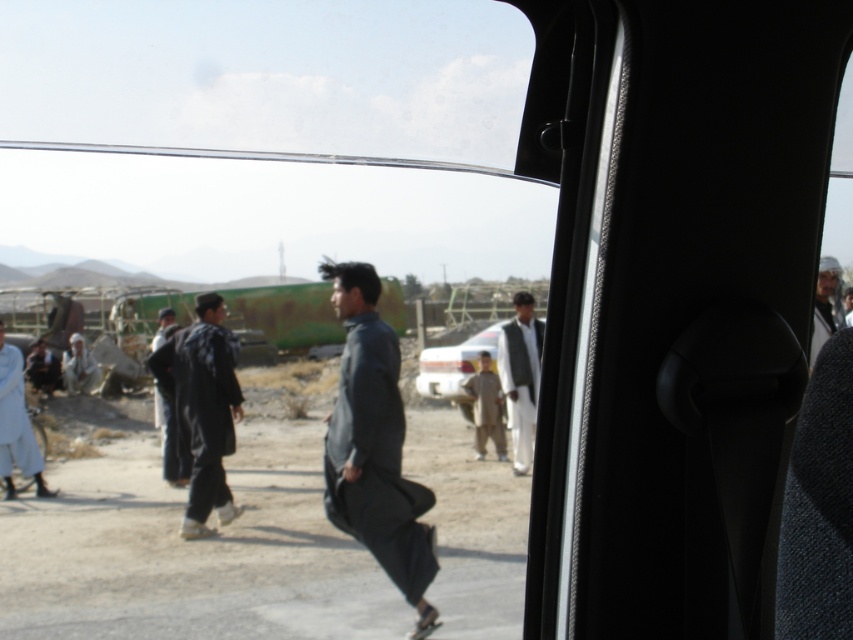
Question: Can you confirm if dark gray fabric at center is thinner than dark gray fabric headscarf at upper right?

Choices:
 (A) no
 (B) yes

Answer: (A)

Question: Which of the following is the closest to the observer?

Choices:
 (A) (341, 444)
 (B) (517, 436)
 (C) (817, 321)
 (D) (503, 445)

Answer: (A)

Question: Among these points, which one is nearest to the camera?

Choices:
 (A) (486, 332)
 (B) (827, 264)
 (C) (403, 572)

Answer: (C)

Question: Can you confirm if dark gray fabric at center is positioned below dark gray fabric headscarf at upper right?

Choices:
 (A) yes
 (B) no

Answer: (A)

Question: Which of the following is the closest to the observer?

Choices:
 (A) white cotton shirt at center
 (B) light blue fabric at left

Answer: (B)

Question: Considering the relative positions of dark gray fabric at center and white cotton shirt at center in the image provided, where is dark gray fabric at center located with respect to white cotton shirt at center?

Choices:
 (A) right
 (B) left

Answer: (B)